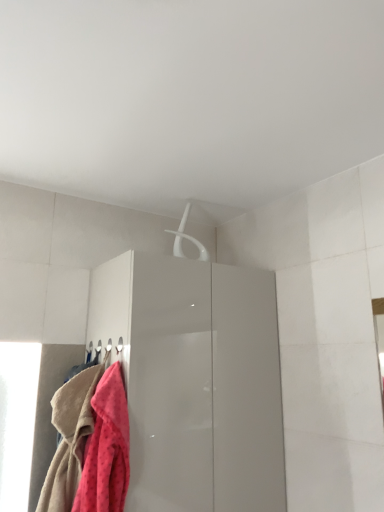
At what (x,y) coordinates should I click in order to perform the action: click on white plastic hanger at upper center. Please return your answer as a coordinate pair (x, y). Looking at the image, I should click on (187, 238).

Locate an element on the screen. This screenshot has height=512, width=384. fluffy pink towel at lower left, which appears as the 2th towel when viewed from the left is located at coordinates (106, 448).

You are a GUI agent. You are given a task and a screenshot of the screen. Output one action in this format:
    pyautogui.click(x=<x>, y=<y>)
    Task: Click on the hanger above the glossy white cabinet at center (from the image's perspective)
    The height and width of the screenshot is (512, 384).
    Given the screenshot: What is the action you would take?
    pyautogui.click(x=187, y=238)

Does glossy white cabinet at center have a greater width compared to white plastic hanger at upper center?

Yes.

How far apart are glossy white cabinet at center and white plastic hanger at upper center?

glossy white cabinet at center and white plastic hanger at upper center are 20.50 inches apart.

Based on the photo, from the image's perspective, is glossy white cabinet at center on white plastic hanger at upper center?

No, from the image's perspective, glossy white cabinet at center is not over white plastic hanger at upper center.

Is fluffy pink towel at lower left, which is counted as the second towel, starting from the right, closer to the viewer compared to white plastic hanger at upper center?

Yes, the depth of fluffy pink towel at lower left, which is counted as the second towel, starting from the right, is less than that of white plastic hanger at upper center.

Considering the sizes of objects fluffy pink towel at lower left, which is counted as the second towel, starting from the right, and white plastic hanger at upper center in the image provided, who is smaller, fluffy pink towel at lower left, which is counted as the second towel, starting from the right, or white plastic hanger at upper center?

Smaller between the two is white plastic hanger at upper center.

Based on the photo, which is nearer, (62, 461) or (180, 245)?

Positioned in front is point (62, 461).

Between fluffy pink towel at lower left, which is counted as the second towel, starting from the right, and white plastic hanger at upper center, which one has less height?

white plastic hanger at upper center.

Can you tell me how much white plastic hanger at upper center and fluffy pink towel at lower left, which is counted as the second towel, starting from the right, differ in facing direction?

The angular difference between white plastic hanger at upper center and fluffy pink towel at lower left, which is counted as the second towel, starting from the right, is 90 degrees.

From a real-world perspective, is white plastic hanger at upper center beneath fluffy pink towel at lower left, which is counted as the second towel, starting from the right?

No, from a real-world perspective, white plastic hanger at upper center is not below fluffy pink towel at lower left, which is counted as the second towel, starting from the right.

Between white plastic hanger at upper center and fluffy pink towel at lower left, which is counted as the second towel, starting from the right, which one has larger size?

Bigger between the two is fluffy pink towel at lower left, which is counted as the second towel, starting from the right.

Image resolution: width=384 pixels, height=512 pixels. I want to click on the 2nd towel directly beneath the white plastic hanger at upper center (from a real-world perspective), so click(x=70, y=439).

In terms of height, does fluffy pink towel at lower left, which is counted as the second towel, starting from the right, look taller or shorter compared to fluffy pink towel at lower left, the first towel from the right?

In the image, fluffy pink towel at lower left, which is counted as the second towel, starting from the right, appears to be taller than fluffy pink towel at lower left, the first towel from the right.

Image resolution: width=384 pixels, height=512 pixels. Find the location of `towel located above the fluffy pink towel at lower left, which is counted as the second towel, starting from the right (from a real-world perspective)`. towel located above the fluffy pink towel at lower left, which is counted as the second towel, starting from the right (from a real-world perspective) is located at coordinates (106, 448).

From the image's perspective, relative to fluffy pink towel at lower left, which appears as the 2th towel when viewed from the left, is fluffy pink towel at lower left, which is counted as the second towel, starting from the right, above or below?

Clearly, from the image's perspective, fluffy pink towel at lower left, which is counted as the second towel, starting from the right, is below fluffy pink towel at lower left, which appears as the 2th towel when viewed from the left.

Is there a large distance between fluffy pink towel at lower left, which is counted as the second towel, starting from the right, and fluffy pink towel at lower left, which appears as the 2th towel when viewed from the left?

fluffy pink towel at lower left, which is counted as the second towel, starting from the right, is actually quite close to fluffy pink towel at lower left, which appears as the 2th towel when viewed from the left.

In terms of width, does fluffy pink towel at lower left, which appears as the 2th towel when viewed from the left, look wider or thinner when compared to fluffy pink towel at lower left, which is counted as the second towel, starting from the right?

fluffy pink towel at lower left, which appears as the 2th towel when viewed from the left, is thinner than fluffy pink towel at lower left, which is counted as the second towel, starting from the right.

Is fluffy pink towel at lower left, the first towel from the right, positioned with its back to fluffy pink towel at lower left, which is counted as the second towel, starting from the right?

That's not correct — fluffy pink towel at lower left, the first towel from the right, is not looking away from fluffy pink towel at lower left, which is counted as the second towel, starting from the right.

Considering the relative sizes of fluffy pink towel at lower left, the first towel from the right, and fluffy pink towel at lower left, which is counted as the second towel, starting from the right, in the image provided, is fluffy pink towel at lower left, the first towel from the right, taller than fluffy pink towel at lower left, which is counted as the second towel, starting from the right,?

In fact, fluffy pink towel at lower left, the first towel from the right, may be shorter than fluffy pink towel at lower left, which is counted as the second towel, starting from the right.

Which is behind, glossy white cabinet at center or fluffy pink towel at lower left, arranged as the 1th towel when viewed from the left?

fluffy pink towel at lower left, arranged as the 1th towel when viewed from the left, is more distant.

Between glossy white cabinet at center and fluffy pink towel at lower left, arranged as the 1th towel when viewed from the left, which one has larger size?

Bigger between the two is glossy white cabinet at center.

Consider the image. Is glossy white cabinet at center aimed at fluffy pink towel at lower left, arranged as the 1th towel when viewed from the left?

No.

In the scene shown: Are glossy white cabinet at center and fluffy pink towel at lower left, arranged as the 1th towel when viewed from the left, making contact?

No, glossy white cabinet at center is not next to fluffy pink towel at lower left, arranged as the 1th towel when viewed from the left.

The height and width of the screenshot is (512, 384). Identify the location of towel in front of the glossy white cabinet at center. (106, 448).

Between fluffy pink towel at lower left, the first towel from the right, and glossy white cabinet at center, which one has less height?

With less height is fluffy pink towel at lower left, the first towel from the right.

From a real-world perspective, is fluffy pink towel at lower left, which appears as the 2th towel when viewed from the left, positioned over glossy white cabinet at center based on gravity?

No.

From the image's perspective, is fluffy pink towel at lower left, which appears as the 2th towel when viewed from the left, above or below glossy white cabinet at center?

From the image's perspective, fluffy pink towel at lower left, which appears as the 2th towel when viewed from the left, appears above glossy white cabinet at center.

The height and width of the screenshot is (512, 384). Identify the location of hanger above the glossy white cabinet at center (from a real-world perspective). (187, 238).

I want to click on hanger above the fluffy pink towel at lower left, which is counted as the second towel, starting from the right (from the image's perspective), so click(x=187, y=238).

Which object lies further to the anchor point white plastic hanger at upper center, fluffy pink towel at lower left, which appears as the 2th towel when viewed from the left, or fluffy pink towel at lower left, arranged as the 1th towel when viewed from the left?

Among the two, fluffy pink towel at lower left, arranged as the 1th towel when viewed from the left, is located further to white plastic hanger at upper center.

Looking at the image, which one is located further to fluffy pink towel at lower left, the first towel from the right, white plastic hanger at upper center or fluffy pink towel at lower left, which is counted as the second towel, starting from the right?

white plastic hanger at upper center.

From the image, which object appears to be farther from glossy white cabinet at center, fluffy pink towel at lower left, arranged as the 1th towel when viewed from the left, or white plastic hanger at upper center?

white plastic hanger at upper center.

Based on their spatial positions, is white plastic hanger at upper center or fluffy pink towel at lower left, arranged as the 1th towel when viewed from the left, closer to glossy white cabinet at center?

fluffy pink towel at lower left, arranged as the 1th towel when viewed from the left, is positioned closer to the anchor glossy white cabinet at center.

Estimate the real-world distances between objects in this image. Which object is further from fluffy pink towel at lower left, arranged as the 1th towel when viewed from the left, white plastic hanger at upper center or fluffy pink towel at lower left, the first towel from the right?

white plastic hanger at upper center.

Looking at the image, which one is located further to white plastic hanger at upper center, glossy white cabinet at center or fluffy pink towel at lower left, which appears as the 2th towel when viewed from the left?

Among the two, fluffy pink towel at lower left, which appears as the 2th towel when viewed from the left, is located further to white plastic hanger at upper center.

When comparing their distances from white plastic hanger at upper center, does glossy white cabinet at center or fluffy pink towel at lower left, arranged as the 1th towel when viewed from the left, seem further?

fluffy pink towel at lower left, arranged as the 1th towel when viewed from the left, is positioned further to the anchor white plastic hanger at upper center.

Looking at this image, which object lies further to the anchor point fluffy pink towel at lower left, the first towel from the right, white plastic hanger at upper center or glossy white cabinet at center?

The object further to fluffy pink towel at lower left, the first towel from the right, is white plastic hanger at upper center.

The height and width of the screenshot is (512, 384). I want to click on dresser between white plastic hanger at upper center and fluffy pink towel at lower left, which is counted as the second towel, starting from the right, vertically, so (195, 381).

Find the location of a particular element. The image size is (384, 512). towel between fluffy pink towel at lower left, arranged as the 1th towel when viewed from the left, and glossy white cabinet at center is located at coordinates (106, 448).

The image size is (384, 512). Find the location of `towel between white plastic hanger at upper center and glossy white cabinet at center from top to bottom`. towel between white plastic hanger at upper center and glossy white cabinet at center from top to bottom is located at coordinates (106, 448).

Find the location of a particular element. The height and width of the screenshot is (512, 384). towel between white plastic hanger at upper center and fluffy pink towel at lower left, arranged as the 1th towel when viewed from the left, vertically is located at coordinates (106, 448).